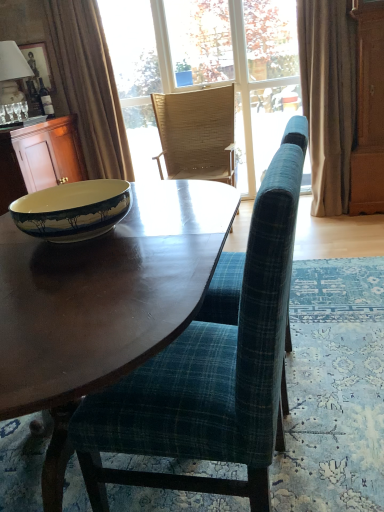
You are a GUI agent. You are given a task and a screenshot of the screen. Output one action in this format:
    pyautogui.click(x=<x>, y=<y>)
    Task: Click on the vacant space in front of beige fabric curtain at right, arranged as the 2th curtain when viewed from the left
    This screenshot has width=384, height=512.
    Given the screenshot: What is the action you would take?
    pyautogui.click(x=349, y=225)